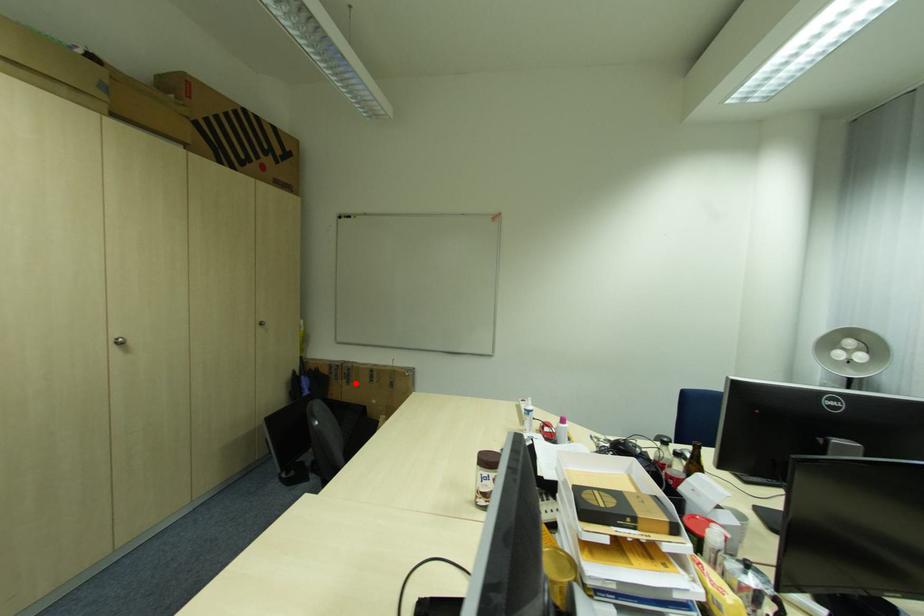
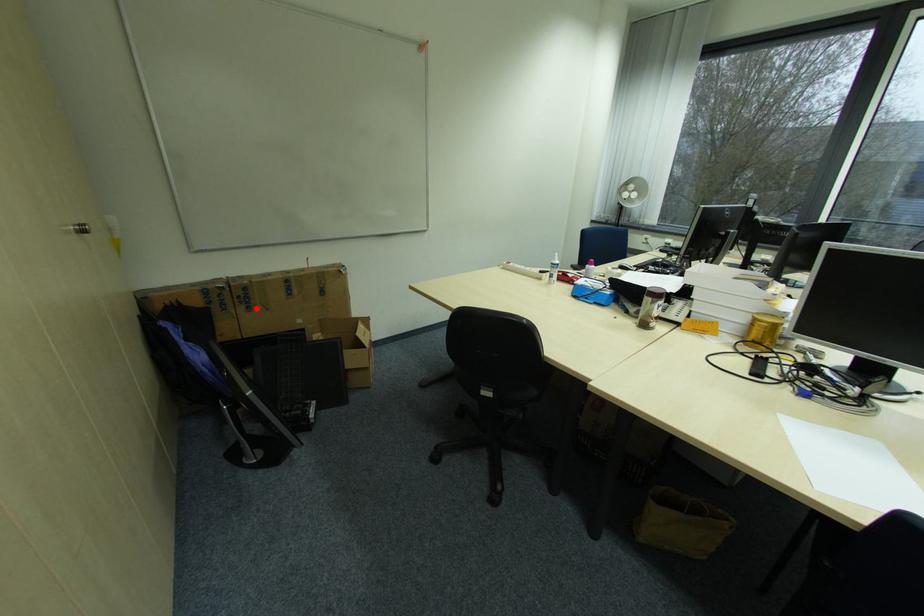
I am providing you with two images of the same scene from different viewpoints. A red point is marked on the first image and another point is marked on the second image. Does the point marked in image1 correspond to the same location as the one in image2?

Yes